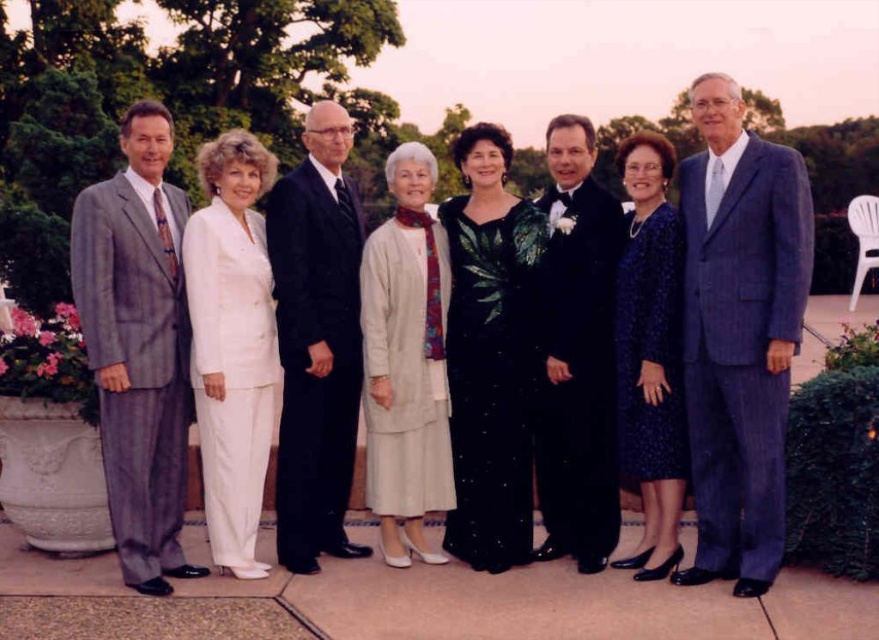
Question: Does matte gray suit at left come behind dark blue textured dress at center?

Choices:
 (A) yes
 (B) no

Answer: (B)

Question: Which of the following is the closest to the observer?

Choices:
 (A) (782, 470)
 (B) (204, 388)
 (C) (587, 161)
 (D) (527, 282)

Answer: (A)

Question: Based on their relative distances, which object is nearer to the dark blue suit at center?

Choices:
 (A) shiny black dress at center
 (B) blue pinstripe suit at right
 (C) dark blue textured dress at center

Answer: (A)

Question: Is matte gray suit at left closer to the viewer compared to gray wool suit at left?

Choices:
 (A) no
 (B) yes

Answer: (B)

Question: Among these objects, which one is farthest from the camera?

Choices:
 (A) blue pinstripe suit at right
 (B) matte gray suit at left
 (C) dark blue textured dress at center

Answer: (C)

Question: Does gray wool suit at left appear on the right side of white satin suit at center?

Choices:
 (A) no
 (B) yes

Answer: (A)